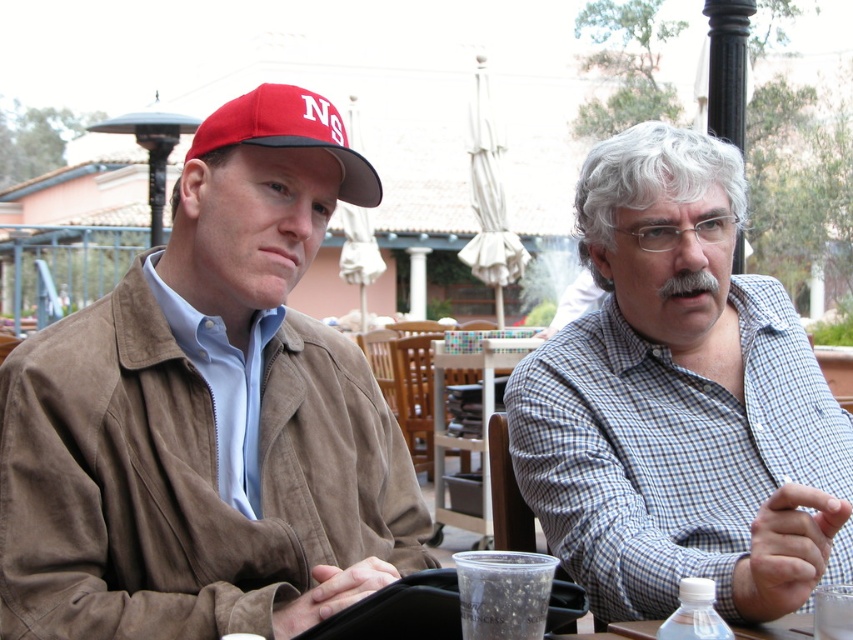
Question: Does red matte baseball cap at upper left appear on the left side of clear plastic cup at lower center?

Choices:
 (A) no
 (B) yes

Answer: (B)

Question: Which point is closer to the camera?

Choices:
 (A) (677, 630)
 (B) (672, 474)
 (C) (285, 212)
 (D) (445, 484)

Answer: (A)

Question: Which object appears farthest from the camera in this image?

Choices:
 (A) clear plastic bottle at lower right
 (B) blue checkered shirt at right

Answer: (B)

Question: Which is nearer to the suede jacket at left?

Choices:
 (A) blue checkered shirt at right
 (B) wooden table at center
 (C) red matte baseball cap at upper left

Answer: (C)

Question: Is blue checkered shirt at right to the right of clear plastic bottle at lower right from the viewer's perspective?

Choices:
 (A) yes
 (B) no

Answer: (A)

Question: Does suede jacket at left lie in front of wooden table at center?

Choices:
 (A) yes
 (B) no

Answer: (A)